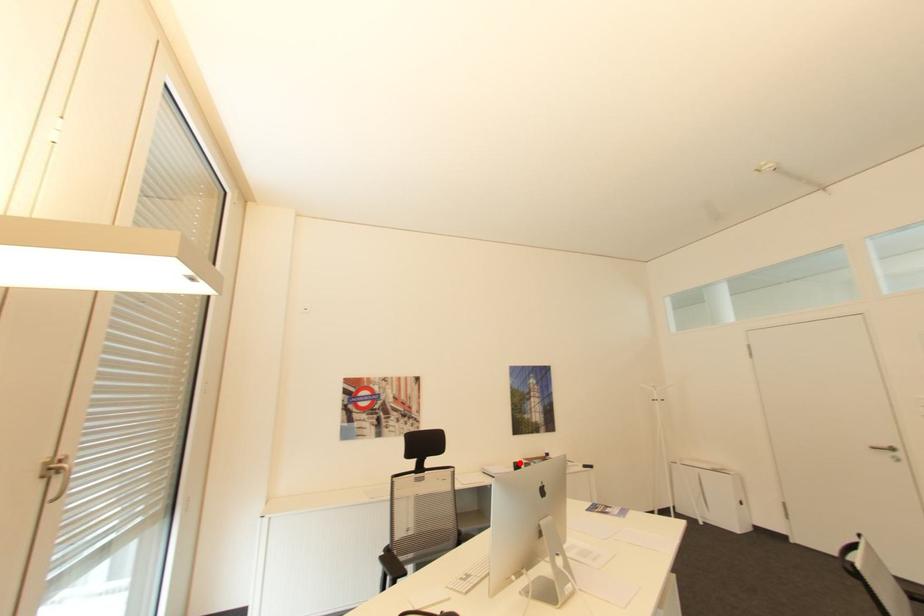
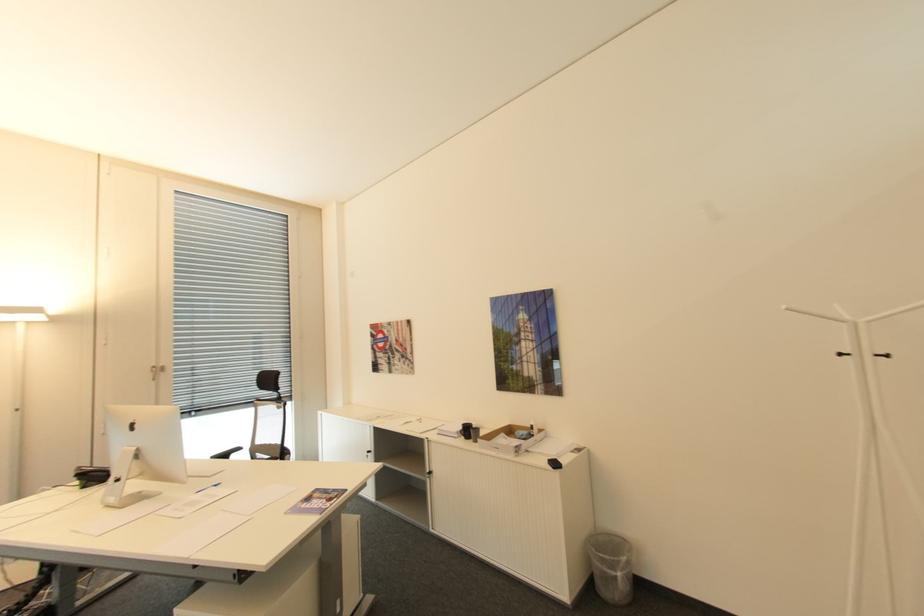
Question: A red point is marked in image1. In image2, is the corresponding 3D point closer to the camera or farther? Reply with the corresponding letter.

Choices:
 (A) The corresponding 3D point is closer.
 (B) The corresponding 3D point is farther.

Answer: (A)